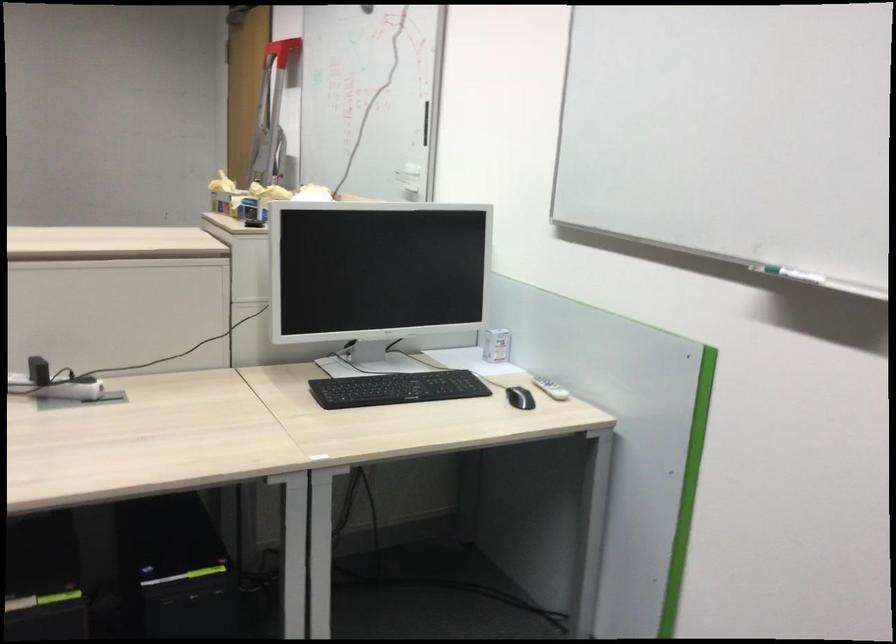
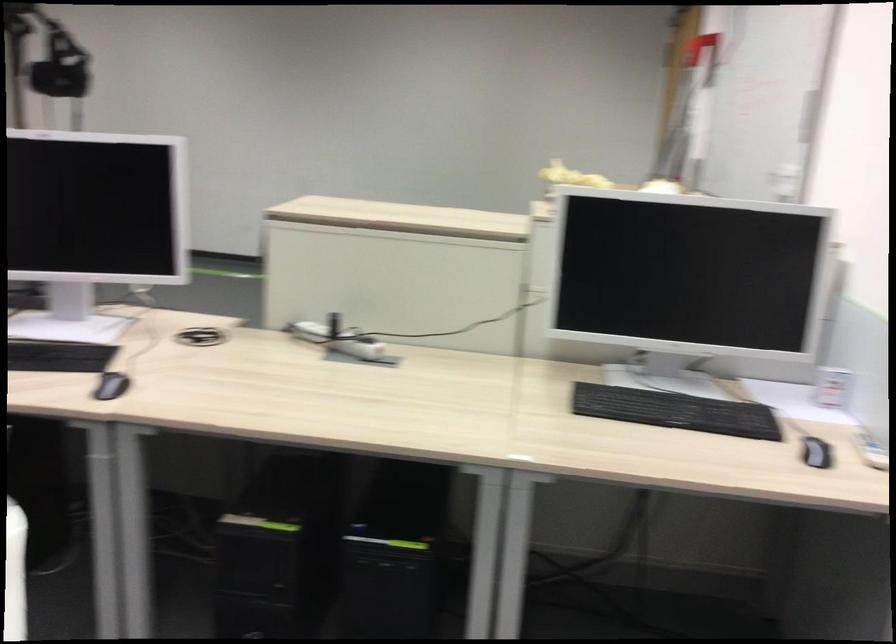
Question: The camera is either moving clockwise (left) or counter-clockwise (right) around the object. The first image is from the beginning of the video and the second image is from the end. Is the camera moving left or right when shooting the video?

Choices:
 (A) Left
 (B) Right

Answer: (B)